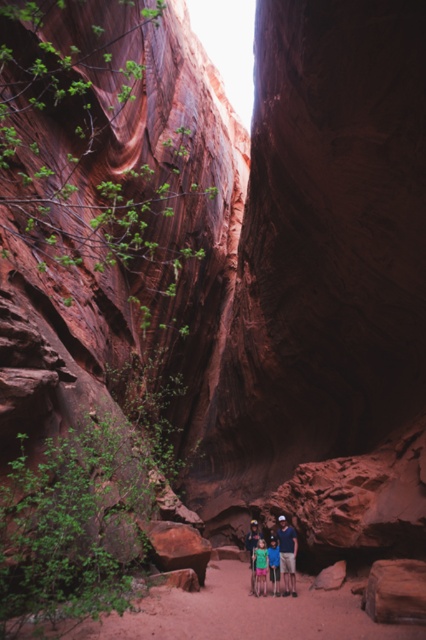
Can you confirm if matte red family at center is thinner than light blue denim shorts at center?

No, matte red family at center is not thinner than light blue denim shorts at center.

Is matte red family at center above light blue denim shorts at center?

Correct, matte red family at center is located above light blue denim shorts at center.

Who is more forward, (282, 536) or (276, 566)?

Point (282, 536)

This screenshot has height=640, width=426. Find the location of `matte red family at center`. matte red family at center is located at coordinates (282, 556).

Is matte red family at center closer to the viewer compared to blue denim jeans at center?

Yes, matte red family at center is in front of blue denim jeans at center.

Who is positioned more to the right, matte red family at center or blue denim jeans at center?

blue denim jeans at center is more to the right.

Is point (293, 582) positioned before point (281, 552)?

Yes, point (293, 582) is in front of point (281, 552).

I want to click on matte red family at center, so click(x=282, y=556).

Can you confirm if blue denim jeans at center is taller than light blue denim shorts at center?

Yes, blue denim jeans at center is taller than light blue denim shorts at center.

Is point (284, 515) farther from viewer compared to point (273, 566)?

Yes.

This screenshot has height=640, width=426. What are the coordinates of `blue denim jeans at center` in the screenshot? It's located at (287, 554).